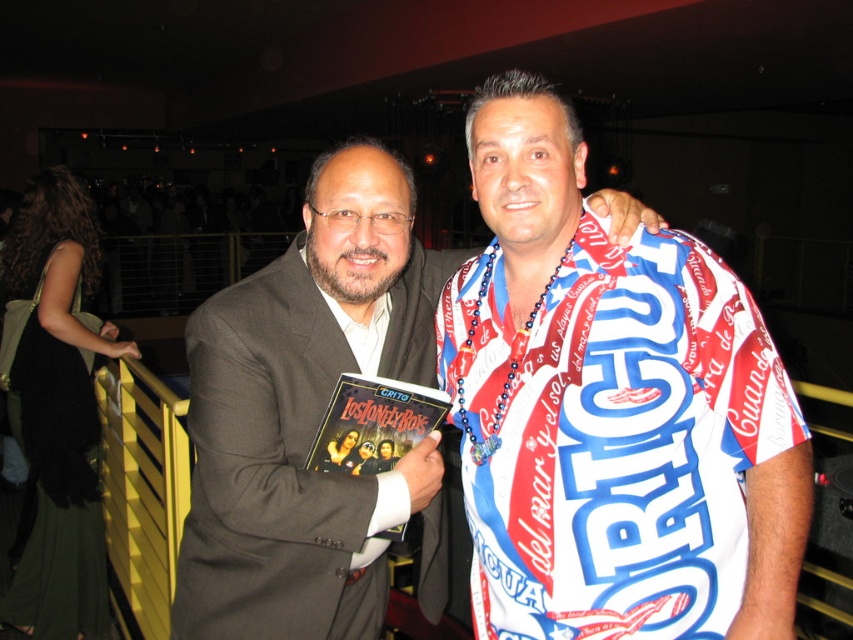
Does printed fabric shirt at center have a greater width compared to matte plastic book at center?

Correct, the width of printed fabric shirt at center exceeds that of matte plastic book at center.

Does point (569, 259) come behind point (413, 420)?

That is False.

Does point (676, 616) come closer to viewer compared to point (408, 410)?

Yes.

Find the location of a particular element. Image resolution: width=853 pixels, height=640 pixels. printed fabric shirt at center is located at coordinates (611, 410).

Does printed fabric shirt at center have a greater height compared to matte black suit at center?

In fact, printed fabric shirt at center may be shorter than matte black suit at center.

Is point (706, 378) closer to camera compared to point (210, 596)?

Yes, point (706, 378) is in front of point (210, 596).

The image size is (853, 640). In order to click on printed fabric shirt at center in this screenshot , I will do `click(611, 410)`.

Can you confirm if matte black suit at center is shorter than matte plastic book at center?

In fact, matte black suit at center may be taller than matte plastic book at center.

Who is more distant from viewer, (376, 256) or (381, 464)?

Positioned behind is point (381, 464).

Locate an element on the screen. matte black suit at center is located at coordinates (310, 419).